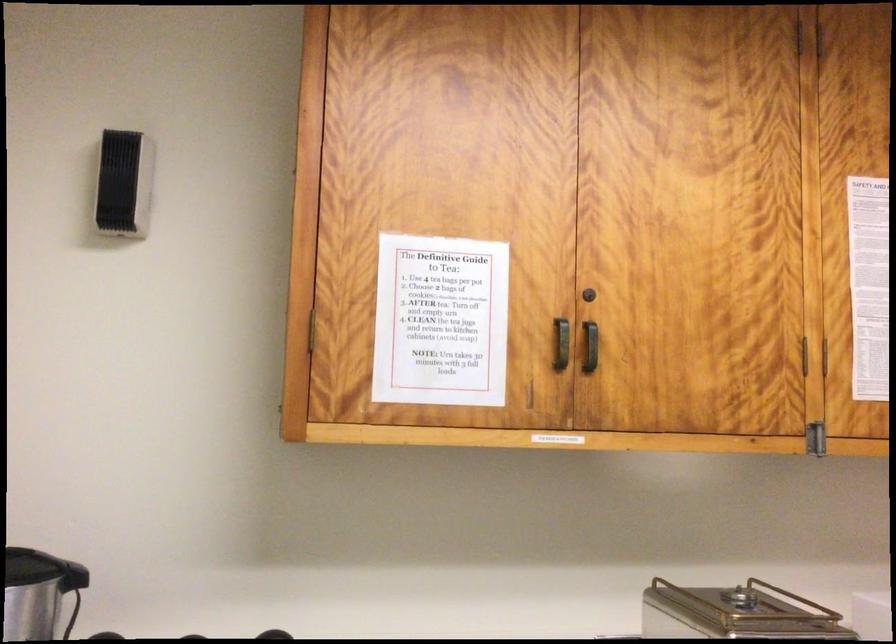
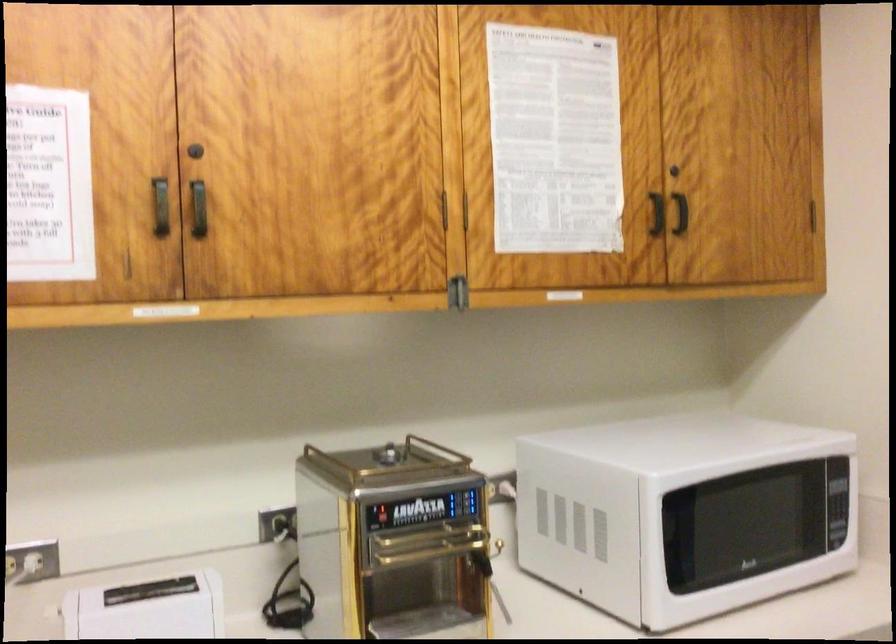
Where in the second image is the point corresponding to (591,348) from the first image?

(197, 209)